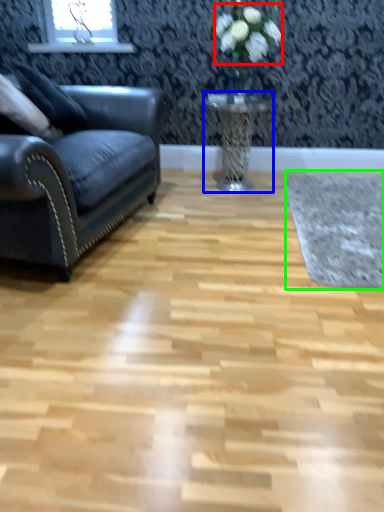
Question: Estimate the real-world distances between objects in this image. Which object is closer to flower (highlighted by a red box), table (highlighted by a blue box) or mat (highlighted by a green box)?

Choices:
 (A) table
 (B) mat

Answer: (A)